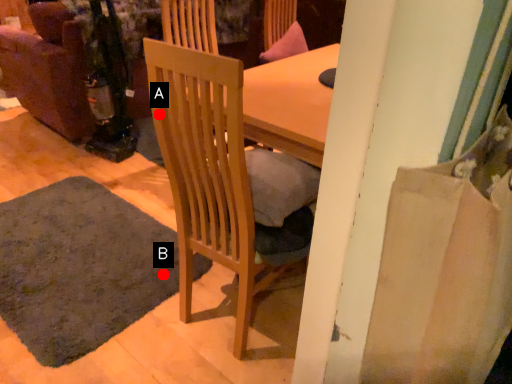
Question: Two points are circled on the image, labeled by A and B beside each circle. Which point appears farthest from the camera in this image?

Choices:
 (A) A is further
 (B) B is further

Answer: (B)